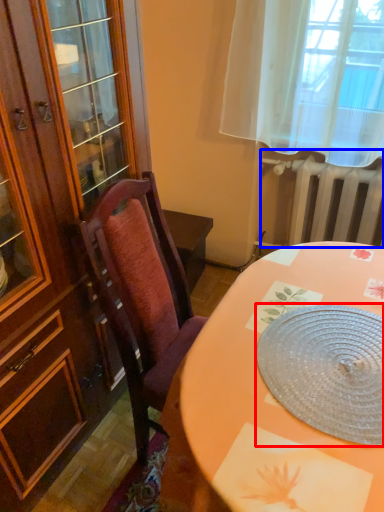
Question: Which object appears farthest to the camera in this image, platter (highlighted by a red box) or radiator (highlighted by a blue box)?

Choices:
 (A) platter
 (B) radiator

Answer: (B)